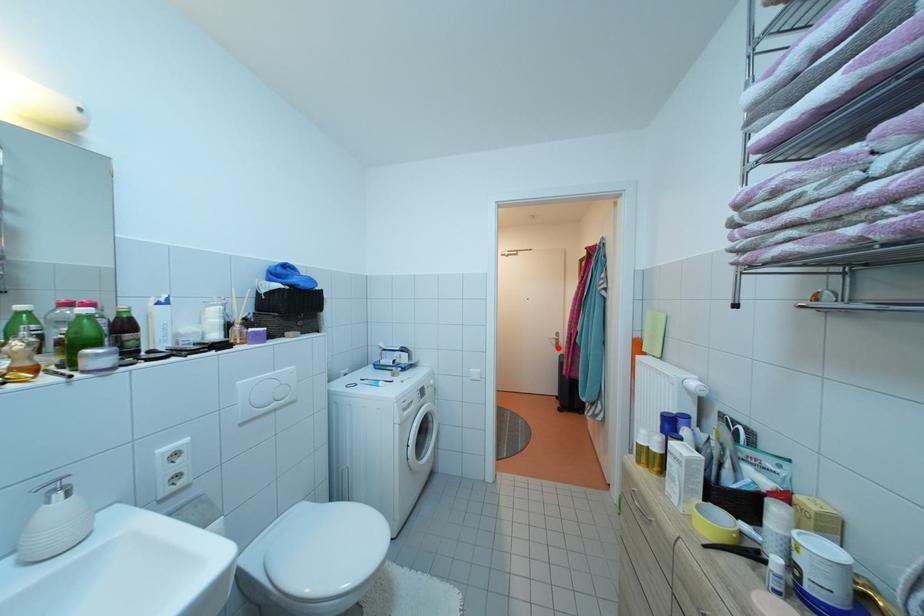
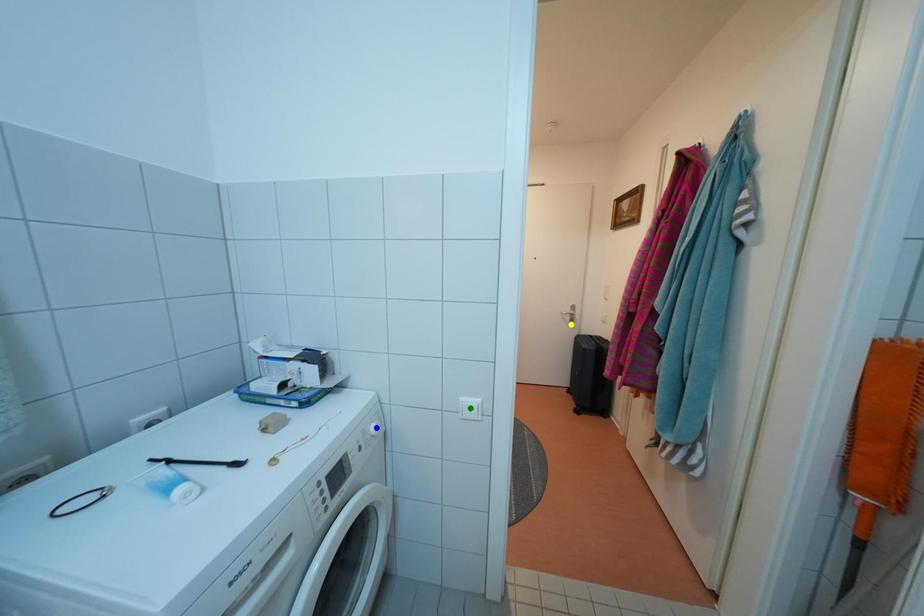
Question: I am providing you with two images of the same scene from different viewpoints. A red point is marked on the first image. You are given multiple points on the second image. Which spot in image 2 lines up with the point in image 1?

Choices:
 (A) yellow point
 (B) blue point
 (C) green point

Answer: (A)